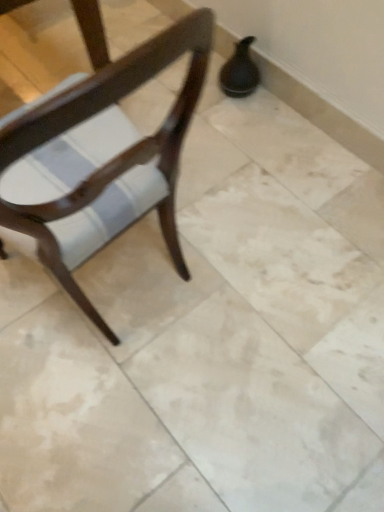
At what (x,y) coordinates should I click in order to perform the action: click on vacant space in front of wooden chair at center. Please return your answer as a coordinate pair (x, y). This screenshot has height=512, width=384. Looking at the image, I should click on (105, 414).